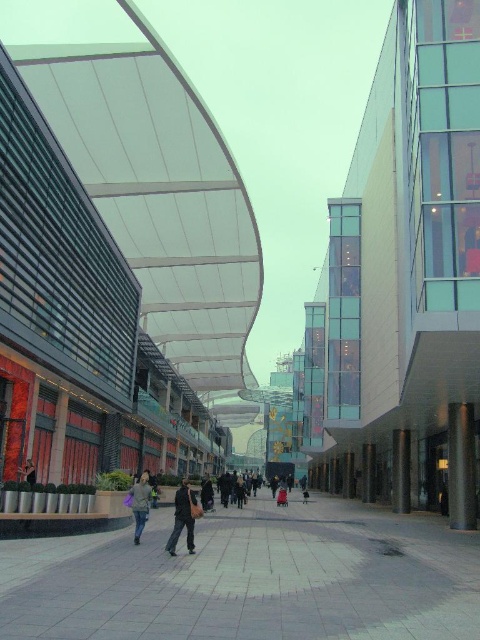
Who is positioned more to the left, smooth concrete plaza at center or light brown fabric jacket at center?

light brown fabric jacket at center is more to the left.

Is smooth concrete plaza at center taller than light brown fabric jacket at center?

Indeed, smooth concrete plaza at center has a greater height compared to light brown fabric jacket at center.

This screenshot has width=480, height=640. What are the coordinates of `smooth concrete plaza at center` in the screenshot? It's located at (250, 579).

Who is more forward, (74, 580) or (360, 477)?

Positioned in front is point (74, 580).

Is smooth concrete plaza at center behind slate gray concrete pillar at center?

No, smooth concrete plaza at center is in front of slate gray concrete pillar at center.

Who is more forward, (166, 621) or (372, 481)?

Point (166, 621) is in front.

Locate an element on the screen. smooth concrete plaza at center is located at coordinates (250, 579).

Can you confirm if dark gray fabric jacket at center is positioned to the left of dark gray fabric jacket at lower left?

Incorrect, dark gray fabric jacket at center is not on the left side of dark gray fabric jacket at lower left.

Between point (180, 518) and point (26, 476), which one is positioned behind?

The point (26, 476) is behind.

Where is `dark gray fabric jacket at center`? dark gray fabric jacket at center is located at coordinates (183, 516).